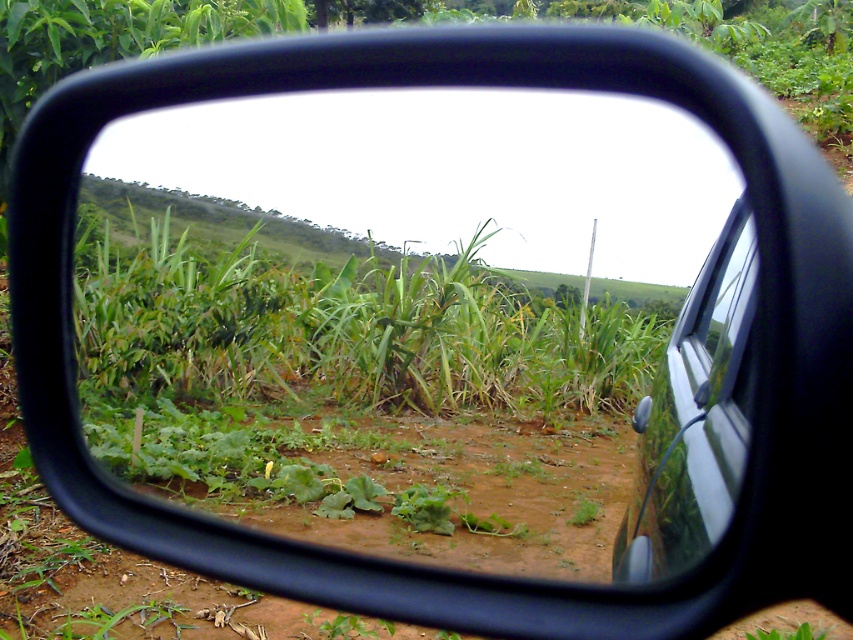
Question: Which of the following is the farthest from the observer?

Choices:
 (A) (717, 472)
 (B) (720, 353)

Answer: (B)

Question: Does green leafy corn field at center appear on the right side of transparent glass car window at right?

Choices:
 (A) yes
 (B) no

Answer: (B)

Question: Is the position of green leafy corn field at center less distant than that of silver metallic car at right?

Choices:
 (A) yes
 (B) no

Answer: (B)

Question: Which of the following is the farthest from the observer?

Choices:
 (A) (691, 291)
 (B) (202, 228)

Answer: (B)

Question: Which object appears closest to the camera in this image?

Choices:
 (A) transparent glass car window at right
 (B) silver metallic car at right
 (C) green leafy corn field at center

Answer: (B)

Question: Does green leafy corn field at center have a greater width compared to silver metallic car at right?

Choices:
 (A) no
 (B) yes

Answer: (B)